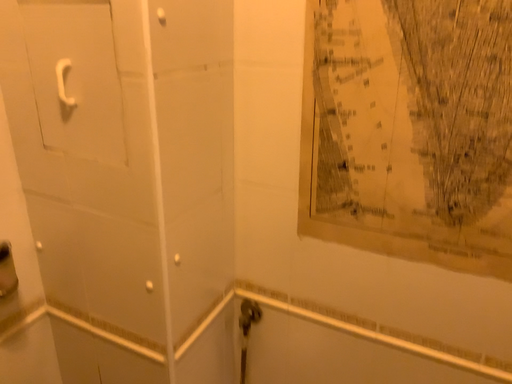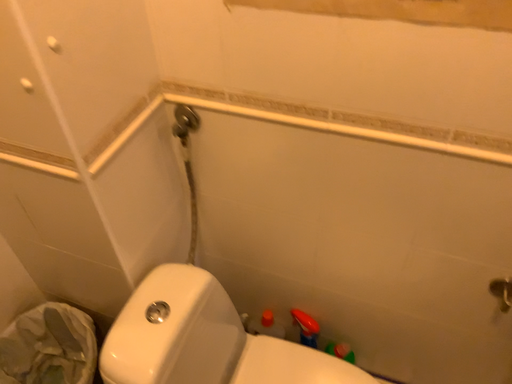
Question: How did the camera likely rotate when shooting the video?

Choices:
 (A) rotated downward
 (B) rotated upward

Answer: (A)